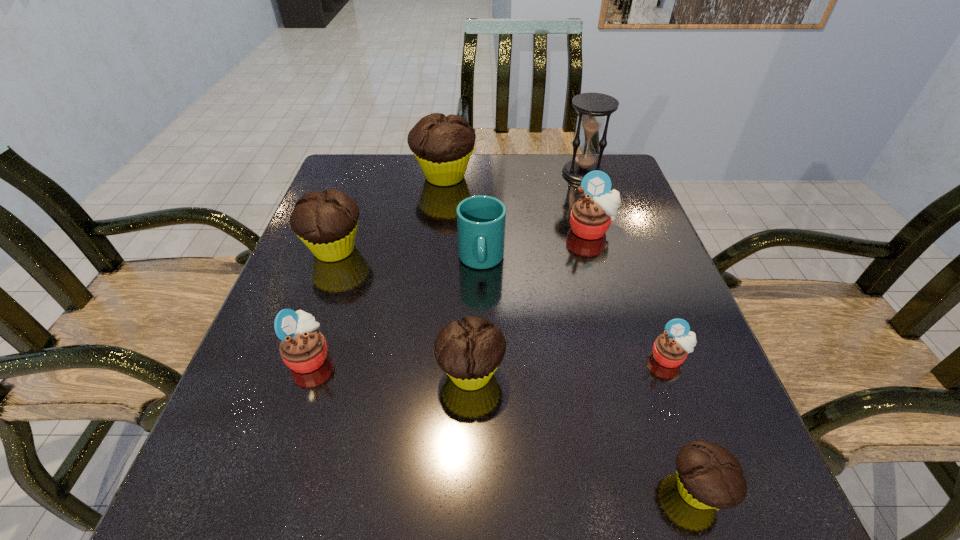
You are a GUI agent. You are given a task and a screenshot of the screen. Output one action in this format:
    pyautogui.click(x=<x>, y=<y>)
    Task: Click on the smallest pink muffin
    The image size is (960, 540).
    Given the screenshot: What is the action you would take?
    pyautogui.click(x=670, y=349)

Locate an element on the screen. the rightmost chocolate muffin is located at coordinates (708, 476).

Find the location of a particular element. The width and height of the screenshot is (960, 540). the nearest object is located at coordinates (708, 476).

The width and height of the screenshot is (960, 540). In order to click on vacant space situated on the front of the tallest object in this screenshot , I will do `click(607, 247)`.

The height and width of the screenshot is (540, 960). I want to click on free space located 0.150m on the front of the biggest chocolate muffin, so click(439, 228).

Identify the location of vacant area located on the front-facing side of the farthest pink muffin. (621, 332).

This screenshot has height=540, width=960. Find the location of `vacant space located on the back of the leftmost chocolate muffin`. vacant space located on the back of the leftmost chocolate muffin is located at coordinates pos(355,193).

Where is `vacant space situated 0.130m on the handle side of the cup`? This screenshot has height=540, width=960. vacant space situated 0.130m on the handle side of the cup is located at coordinates (481, 329).

Where is `vacant position located 0.170m on the front-facing side of the second smallest pink muffin`? vacant position located 0.170m on the front-facing side of the second smallest pink muffin is located at coordinates (423, 356).

Locate an element on the screen. free space located 0.360m on the right of the second smallest chocolate muffin is located at coordinates (708, 373).